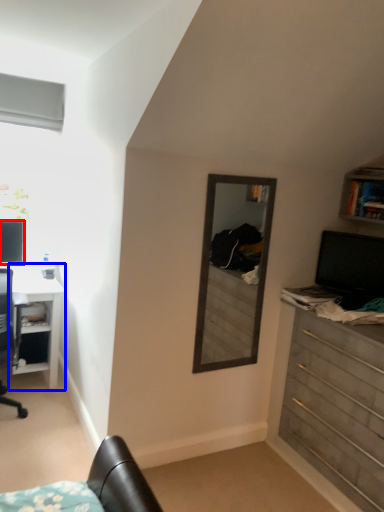
Question: Which of the following is the farthest to the observer, computer monitor (highlighted by a red box) or desk (highlighted by a blue box)?

Choices:
 (A) computer monitor
 (B) desk

Answer: (A)